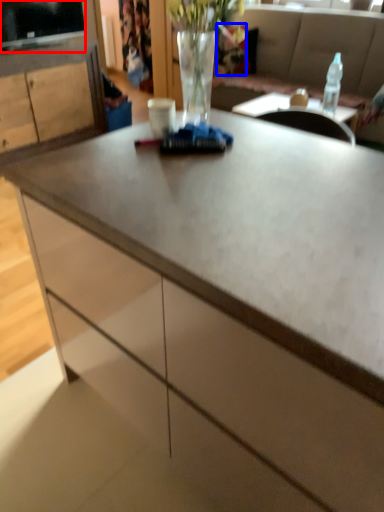
Question: Which of the following is the closest to the observer, television (highlighted by a red box) or flower (highlighted by a blue box)?

Choices:
 (A) television
 (B) flower

Answer: (A)